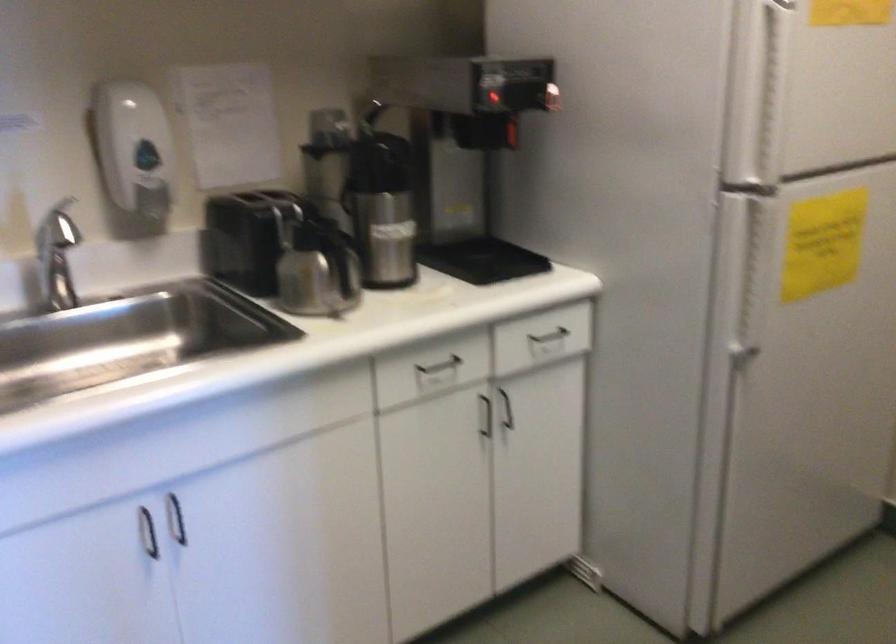
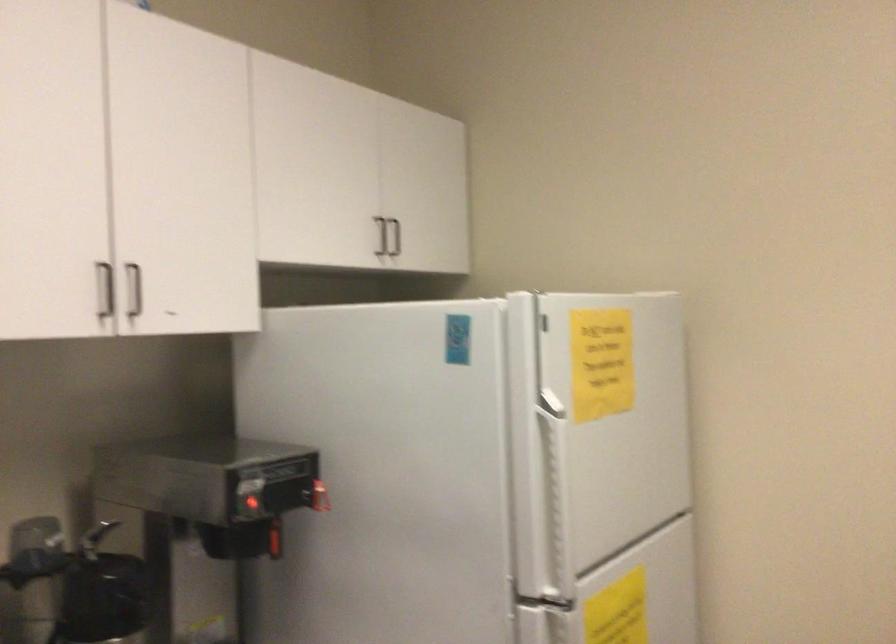
Locate, in the second image, the point that corresponds to (513,134) in the first image.

(273, 541)